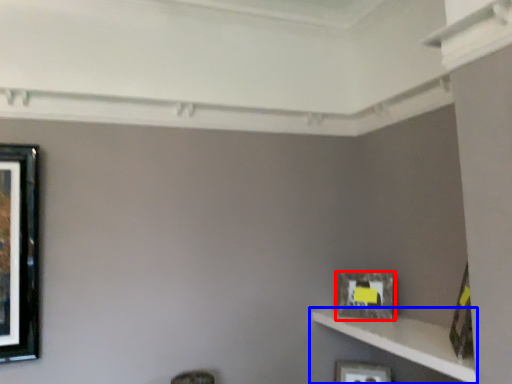
Question: Which of the following is the closest to the observer, picture frame (highlighted by a red box) or shelf (highlighted by a blue box)?

Choices:
 (A) picture frame
 (B) shelf

Answer: (B)